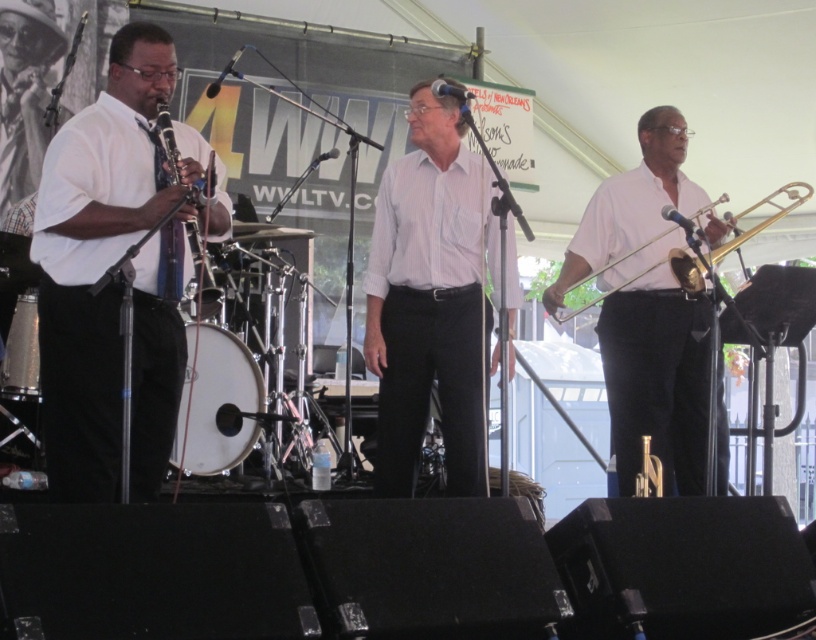
You are a photographer at the jazz band performance and want to capture both the matte wood clarinet at left and the gold brass trombone at right in a single shot. Which instrument should you position closer to the left edge of the frame to ensure both are visible?

The matte wood clarinet at left is already positioned on the left side of the gold brass trombone at right, so you should keep it near the left edge of the frame to include both instruments in the shot.

You are standing at the point closest to the audience in the image. There are two points marked in the scene, one at coordinates point (424, 177) and another at point (167, 144). Which of these points is farther away from you?

Point (424, 177) is behind point (167, 144), so it is farther away from you.